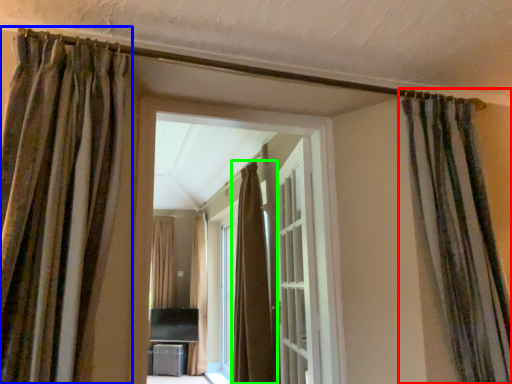
Question: Considering the real-world distances, which object is farthest from curtain (highlighted by a red box)? curtain (highlighted by a blue box) or curtain (highlighted by a green box)?

Choices:
 (A) curtain
 (B) curtain

Answer: (B)